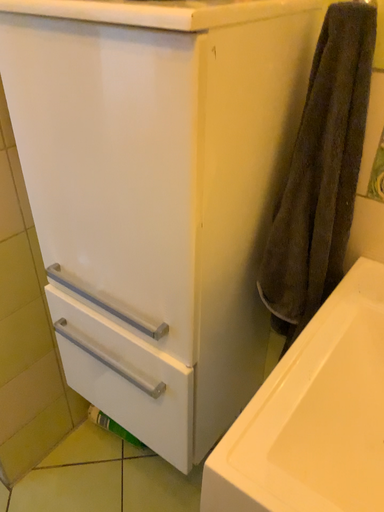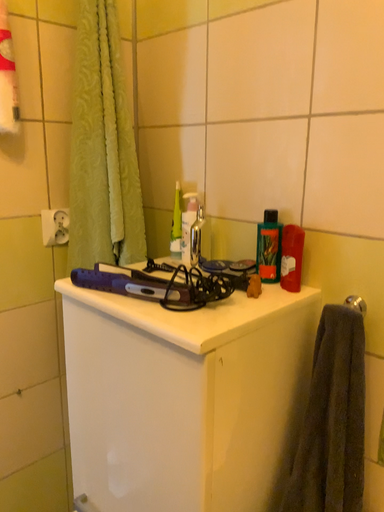
Question: Which way did the camera rotate in the video?

Choices:
 (A) rotated right
 (B) rotated left

Answer: (B)